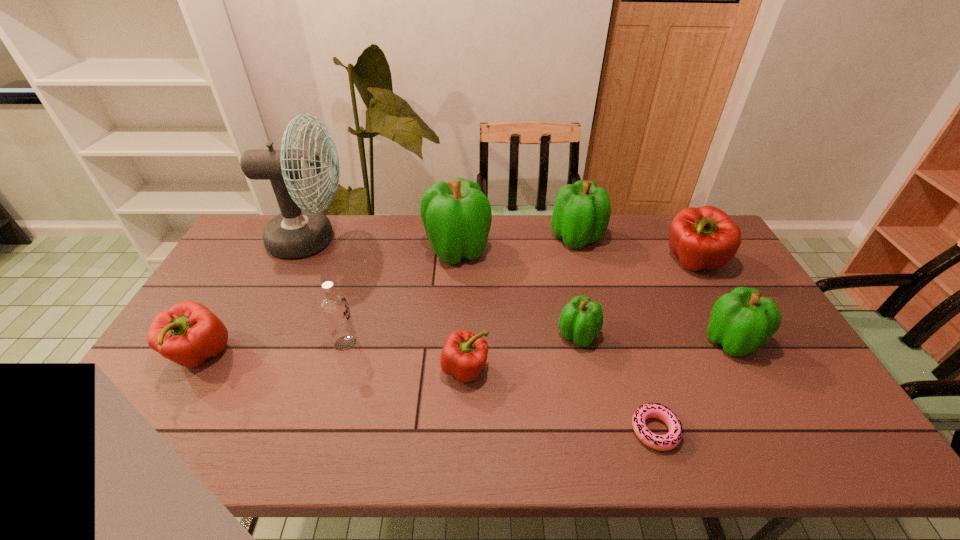
This screenshot has width=960, height=540. I want to click on the tallest object, so click(299, 231).

This screenshot has width=960, height=540. In order to click on the ninth shortest object in this screenshot , I will do `click(457, 216)`.

Locate an element on the screen. the biggest green bell pepper is located at coordinates (457, 216).

Locate an element on the screen. This screenshot has height=540, width=960. the second biggest green bell pepper is located at coordinates (581, 214).

Find the location of a particular element. This screenshot has width=960, height=540. the third object from left to right is located at coordinates (334, 307).

Where is `the rightmost pink bell pepper`? This screenshot has width=960, height=540. the rightmost pink bell pepper is located at coordinates (705, 237).

The height and width of the screenshot is (540, 960). Identify the location of the biggest pink bell pepper. (705, 237).

Identify the location of the rightmost green bell pepper. (741, 321).

Locate an element on the screen. the leftmost pink bell pepper is located at coordinates (188, 333).

This screenshot has width=960, height=540. I want to click on the second smallest pink bell pepper, so click(188, 333).